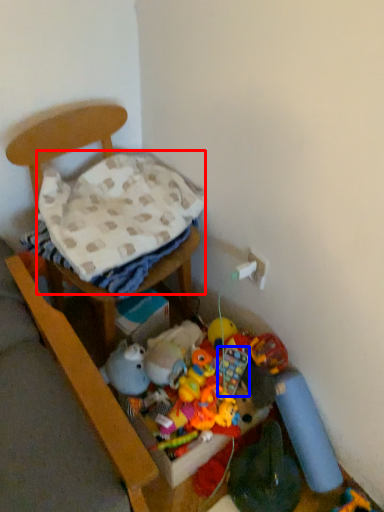
Question: Which point is further to the camera, blanket (highlighted by a red box) or toy (highlighted by a blue box)?

Choices:
 (A) blanket
 (B) toy

Answer: (B)